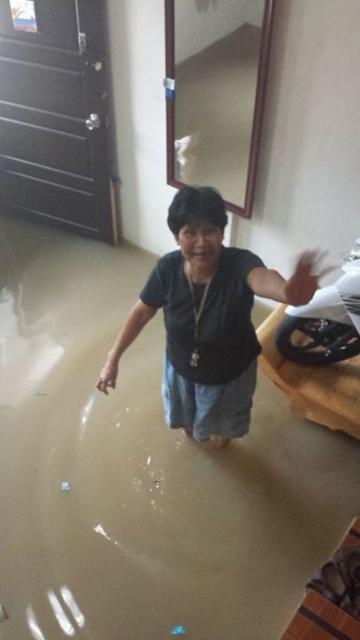
Question: Where is brown matte water at center located in relation to shiny black motorcycle at center in the image?

Choices:
 (A) left
 (B) right

Answer: (A)

Question: Which object appears farthest from the camera in this image?

Choices:
 (A) brown matte water at center
 (B) shiny black motorcycle at center

Answer: (B)

Question: Which object is the closest to the brown matte water at center?

Choices:
 (A) shiny black motorcycle at center
 (B) matte black shirt at center

Answer: (B)

Question: Is brown matte water at center below matte black shirt at center?

Choices:
 (A) yes
 (B) no

Answer: (A)

Question: Which point is farther from the camera taking this photo?

Choices:
 (A) (29, 564)
 (B) (342, 339)

Answer: (B)

Question: Is matte black shirt at center positioned behind shiny black motorcycle at center?

Choices:
 (A) yes
 (B) no

Answer: (B)